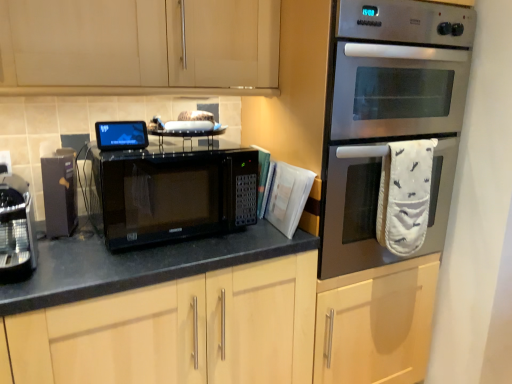
Find the location of a particular element. free spot to the right of sleek metallic coffee machine at left, acting as the 1th appliance starting from the left is located at coordinates (72, 263).